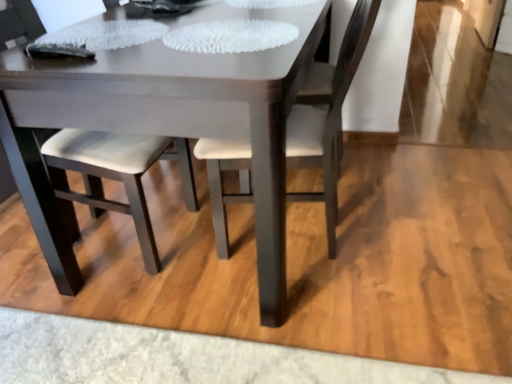
Question: Relative to white leather chair at center, which is the 2th chair in left-to-right order, is matte white table at center in front or behind?

Choices:
 (A) behind
 (B) front

Answer: (B)

Question: From a real-world perspective, relative to white leather chair at center, which is the 2th chair in left-to-right order, is matte white table at center vertically above or below?

Choices:
 (A) below
 (B) above

Answer: (A)

Question: Which object is the closest to the matte white table at center?

Choices:
 (A) white leather chair at center, placed as the first chair when sorted from right to left
 (B) matte white chair at center, which appears as the 2th chair when viewed from the right

Answer: (B)

Question: Estimate the real-world distances between objects in this image. Which object is farther from the matte white chair at center, which appears as the 2th chair when viewed from the right?

Choices:
 (A) matte white table at center
 (B) white leather chair at center, which is the 2th chair in left-to-right order

Answer: (B)